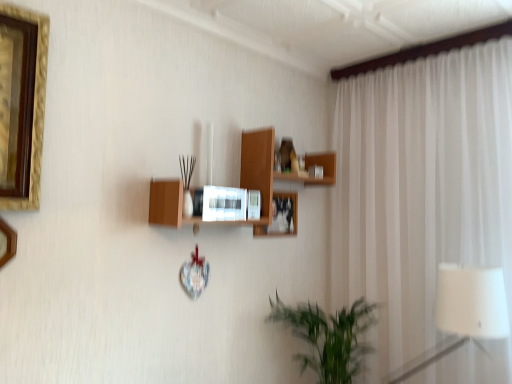
At what (x,y) coordinates should I click in order to perform the action: click on empty space that is ontop of white sheer curtain at right. Please return your answer as a coordinate pair (x, y). The height and width of the screenshot is (384, 512). Looking at the image, I should click on (413, 66).